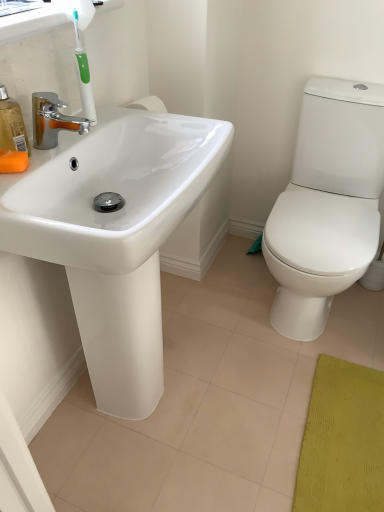
What do you see at coordinates (374, 273) in the screenshot? This screenshot has width=384, height=512. I see `white matte toilet paper at right` at bounding box center [374, 273].

What do you see at coordinates (12, 125) in the screenshot? The height and width of the screenshot is (512, 384). I see `translucent orange soap dispenser at left` at bounding box center [12, 125].

Find the location of a particular element. Image resolution: width=384 pixels, height=512 pixels. white matte toilet paper at right is located at coordinates (374, 273).

From a real-world perspective, which object rests below the other?

white matte toilet paper at right, from a real-world perspective.

How different are the orientations of white matte toilet paper at right and orange matte soap at left in degrees?

The angular difference between white matte toilet paper at right and orange matte soap at left is 110 degrees.

Is white matte toilet paper at right spatially inside orange matte soap at left, or outside of it?

white matte toilet paper at right is not inside orange matte soap at left, it's outside.

Which is farther from the camera, (373, 276) or (12, 169)?

Positioned behind is point (373, 276).

From a real-world perspective, is white matte toilet paper at right over translucent orange soap dispenser at left?

No, from a real-world perspective, white matte toilet paper at right is not above translucent orange soap dispenser at left.

Measure the distance between white matte toilet paper at right and translucent orange soap dispenser at left.

white matte toilet paper at right is 4.61 feet away from translucent orange soap dispenser at left.

Which is behind, point (382, 246) or point (15, 123)?

The point (382, 246) is farther.

Consider the image. From the image's perspective, which one is positioned lower, white matte toilet paper at right or translucent orange soap dispenser at left?

white matte toilet paper at right is shown below in the image.

Does white glossy sink at left have a greater width compared to orange matte soap at left?

Yes.

From a real-world perspective, is white glossy sink at left under orange matte soap at left?

Yes, from a real-world perspective, white glossy sink at left is under orange matte soap at left.

Could you tell me if white glossy sink at left is turned towards orange matte soap at left?

No, white glossy sink at left is not facing towards orange matte soap at left.

Does white glossy sink at left come in front of orange matte soap at left?

Yes, white glossy sink at left is closer to the camera.

Between orange matte soap at left and white matte toilet paper at right, which one appears on the left side from the viewer's perspective?

orange matte soap at left.

Which object is wider, orange matte soap at left or white matte toilet paper at right?

white matte toilet paper at right.

From the picture: Is white matte toilet paper at right located within orange matte soap at left?

Actually, white matte toilet paper at right is outside orange matte soap at left.

Is point (189, 188) behind point (13, 125)?

No, (189, 188) is in front of (13, 125).

Which object is positioned more to the right, white glossy sink at left or translucent orange soap dispenser at left?

Positioned to the right is white glossy sink at left.

Find the location of `soap dispenser above the white glossy sink at left (from a real-world perspective)`. soap dispenser above the white glossy sink at left (from a real-world perspective) is located at coordinates (12, 125).

From the picture: Which of these two, white glossy sink at left or translucent orange soap dispenser at left, is thinner?

translucent orange soap dispenser at left is thinner.

Does white glossy sink at left lie in front of white matte toilet paper at right?

That is True.

In the scene shown: Measure the distance between white glossy sink at left and white matte toilet paper at right.

They are 3.67 feet apart.

Which of these two, white glossy sink at left or white matte toilet paper at right, is thinner?

white matte toilet paper at right.

Would you say white glossy sink at left is a long distance from white matte toilet paper at right?

Indeed, white glossy sink at left is not near white matte toilet paper at right.

Is translucent orange soap dispenser at left in contact with white glossy sink at left?

No, translucent orange soap dispenser at left is not with white glossy sink at left.

In terms of width, does translucent orange soap dispenser at left look wider or thinner when compared to white glossy sink at left?

translucent orange soap dispenser at left is thinner than white glossy sink at left.

Between translucent orange soap dispenser at left and white glossy sink at left, which one is positioned behind?

translucent orange soap dispenser at left.

In order to click on soap lying in front of the white matte toilet paper at right in this screenshot , I will do click(13, 161).

Image resolution: width=384 pixels, height=512 pixels. I want to click on toilet paper behind the translucent orange soap dispenser at left, so click(374, 273).

Estimate the real-world distances between objects in this image. Which object is closer to orange matte soap at left, translucent orange soap dispenser at left or white matte toilet paper at right?

Among the two, translucent orange soap dispenser at left is located nearer to orange matte soap at left.

From the image, which object appears to be nearer to white matte toilet paper at right, white glossy sink at left or orange matte soap at left?

The object closer to white matte toilet paper at right is white glossy sink at left.

When comparing their distances from white glossy sink at left, does translucent orange soap dispenser at left or white matte toilet paper at right seem further?

Based on the image, white matte toilet paper at right appears to be further to white glossy sink at left.

Based on their spatial positions, is white glossy sink at left or translucent orange soap dispenser at left closer to orange matte soap at left?

translucent orange soap dispenser at left lies closer to orange matte soap at left than the other object.

Looking at the image, which one is located further to white matte toilet paper at right, orange matte soap at left or white glossy sink at left?

Among the two, orange matte soap at left is located further to white matte toilet paper at right.

Estimate the real-world distances between objects in this image. Which object is closer to translucent orange soap dispenser at left, white matte toilet paper at right or white glossy sink at left?

The object closer to translucent orange soap dispenser at left is white glossy sink at left.

Estimate the real-world distances between objects in this image. Which object is further from orange matte soap at left, white matte toilet paper at right or white glossy sink at left?

Among the two, white matte toilet paper at right is located further to orange matte soap at left.

Considering their positions, is translucent orange soap dispenser at left positioned further to white matte toilet paper at right than white glossy sink at left?

Based on the image, translucent orange soap dispenser at left appears to be further to white matte toilet paper at right.

Locate an element on the screen. soap dispenser situated between orange matte soap at left and white matte toilet paper at right from left to right is located at coordinates (12, 125).

Where is `soap between translucent orange soap dispenser at left and white glossy sink at left in the vertical direction`? The image size is (384, 512). soap between translucent orange soap dispenser at left and white glossy sink at left in the vertical direction is located at coordinates (13, 161).

You are a GUI agent. You are given a task and a screenshot of the screen. Output one action in this format:
    pyautogui.click(x=<x>, y=<y>)
    Task: Click on the sink located between translucent orange soap dispenser at left and white matte toilet paper at right in the left-right direction
    The width and height of the screenshot is (384, 512).
    Given the screenshot: What is the action you would take?
    click(x=116, y=238)

I want to click on sink between orange matte soap at left and white matte toilet paper at right, so click(116, 238).